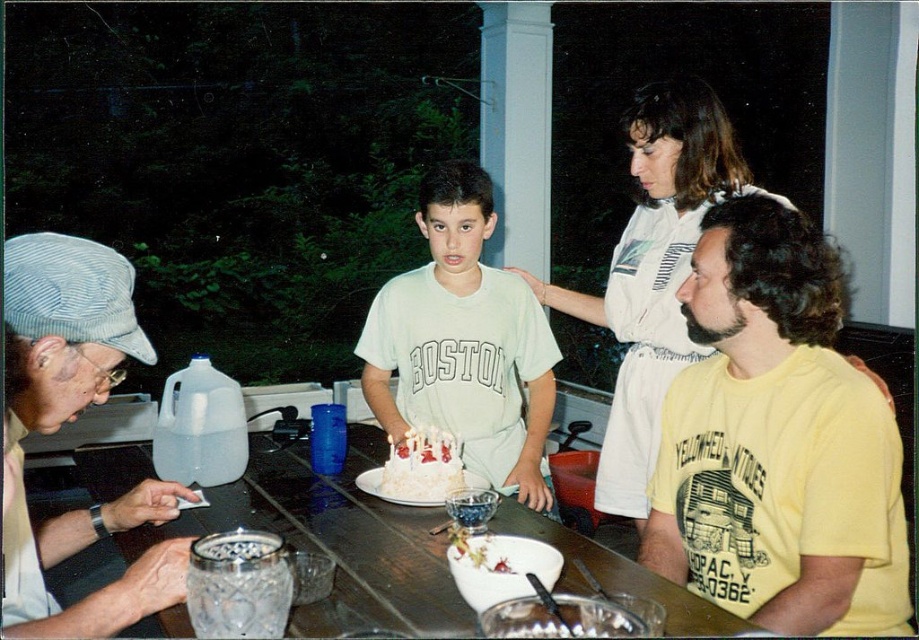
You are organizing a small party and need to arrange seating. There are two guests wearing the khaki fabric cap at left and the white cotton shirt at center. Which guest should you seat closer to the birthday cake to ensure they can easily reach it without moving their seat?

The khaki fabric cap at left should be seated closer to the birthday cake because it is smaller than the white cotton shirt at center, allowing for a more compact arrangement near the cake.

You are a photographer at the event and want to take a photo that includes both the white cotton shirt at upper center and the white frosted cake at center. Which object should you position closer to the camera to ensure both are in focus?

To ensure both the white cotton shirt at upper center and the white frosted cake at center are in focus, position the white cotton shirt at upper center closer to the camera since it has a greater height than the white frosted cake at center.